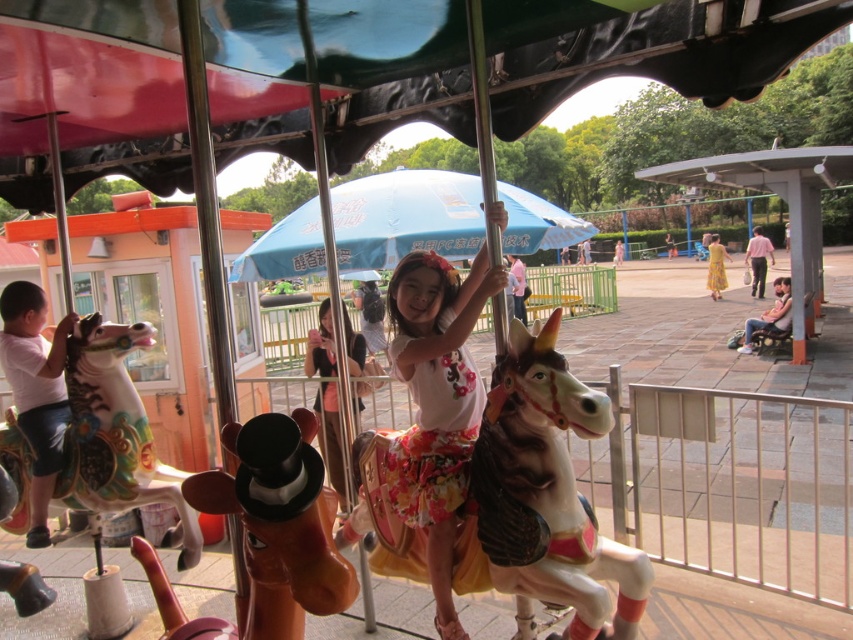
Question: Does floral cotton dress at center appear under painted wood horse at left?

Choices:
 (A) yes
 (B) no

Answer: (B)

Question: Can you confirm if painted wood horse at left is bigger than floral fabric dress at center?

Choices:
 (A) no
 (B) yes

Answer: (A)

Question: Which object is positioned closest to the white glossy horse at center?

Choices:
 (A) floral fabric dress at center
 (B) painted wood horse at left
 (C) floral cotton dress at center

Answer: (C)

Question: Does floral cotton dress at center appear over floral fabric dress at center?

Choices:
 (A) yes
 (B) no

Answer: (B)

Question: Among these objects, which one is farthest from the camera?

Choices:
 (A) white glossy horse at center
 (B) floral fabric dress at center
 (C) painted wood horse at left
 (D) floral cotton dress at center

Answer: (B)

Question: Estimate the real-world distances between objects in this image. Which object is farther from the white glossy horse at center?

Choices:
 (A) floral fabric dress at center
 (B) painted wood horse at left
 (C) floral cotton dress at center

Answer: (A)